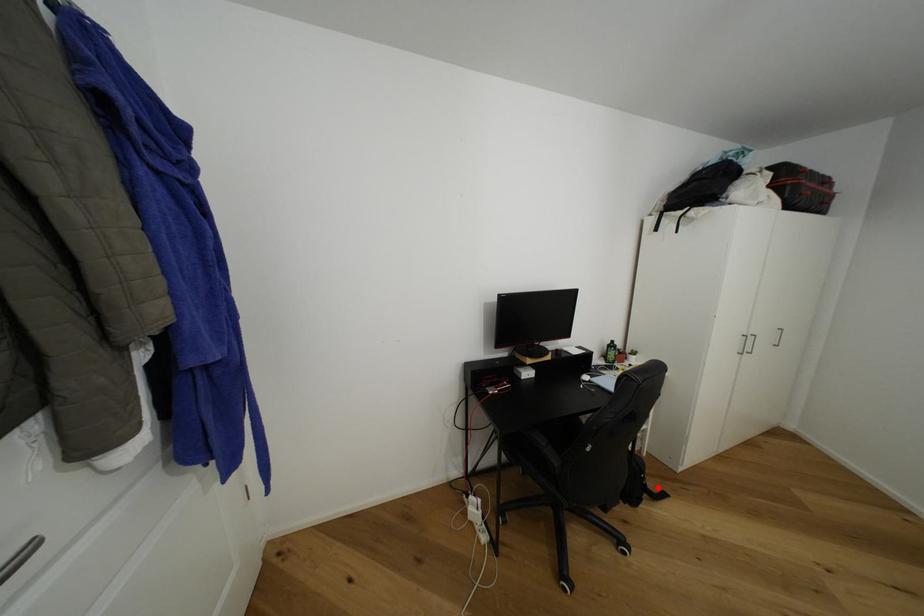
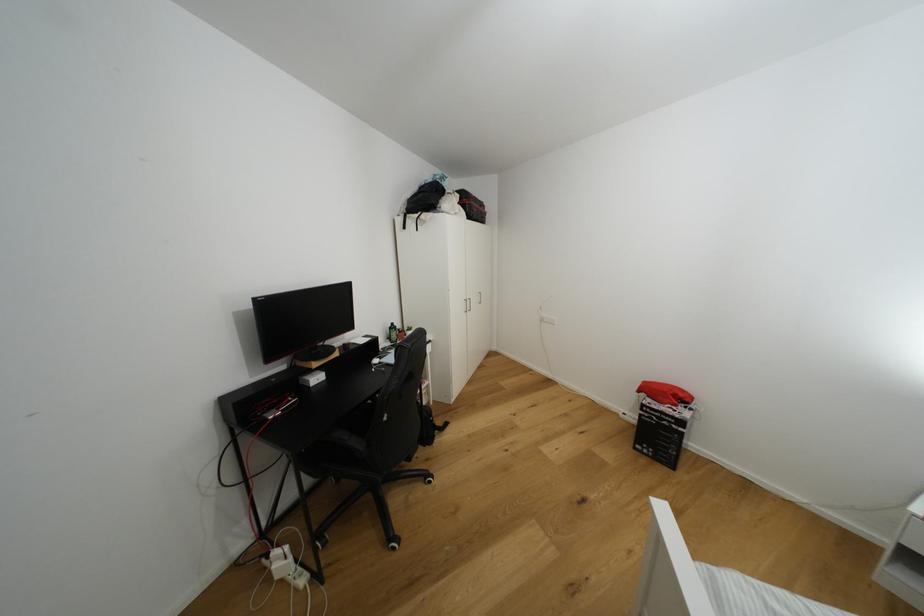
Question: I am providing you with two images of the same scene from different viewpoints. A red point is marked on the first image. At the location where the point appears in image 1, is it still visible in image 2?

Choices:
 (A) Yes
 (B) No

Answer: (A)